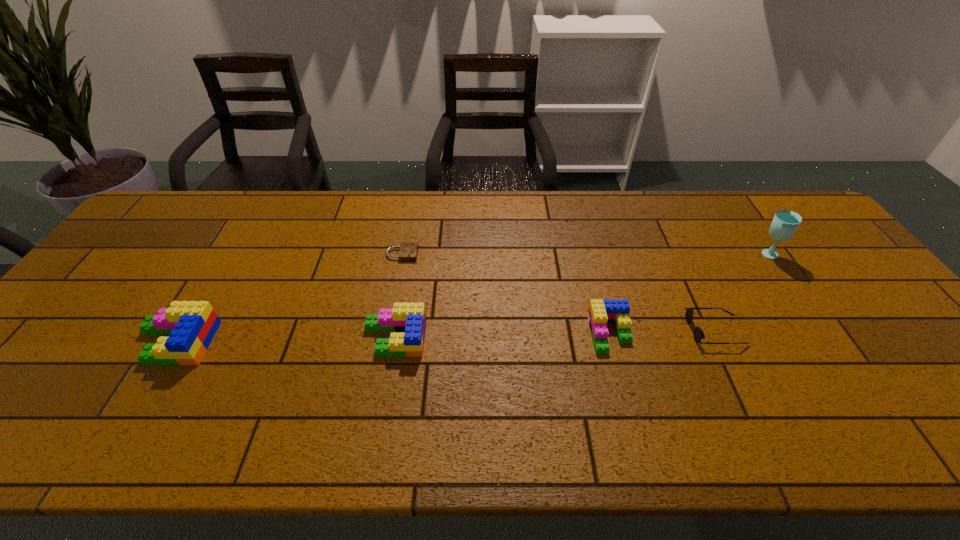
I want to click on free space located on the right of the leftmost Lego, so click(x=268, y=343).

Locate an element on the screen. This screenshot has width=960, height=540. vacant region located 0.320m on the back of the second Lego from left to right is located at coordinates (411, 240).

In order to click on blank area located on the back of the rightmost Lego in this screenshot , I will do `click(592, 267)`.

Image resolution: width=960 pixels, height=540 pixels. In order to click on free space located 0.270m on the left of the glass in this screenshot , I will do `click(666, 253)`.

This screenshot has width=960, height=540. I want to click on free spot located 0.370m on the keyhole side of the padlock, so click(541, 254).

I want to click on vacant space located 0.260m on the front-facing side of the fifth object from left to right, so click(x=587, y=330).

The height and width of the screenshot is (540, 960). I want to click on free space located 0.270m on the front-facing side of the fifth object from left to right, so click(x=583, y=330).

The height and width of the screenshot is (540, 960). I want to click on blank area located 0.150m on the front-facing side of the fifth object from left to right, so point(630,330).

At what (x,y) coordinates should I click in order to perform the action: click on free space at the far edge of the desktop. Please return your answer as a coordinate pair (x, y). Looking at the image, I should click on (232, 201).

The width and height of the screenshot is (960, 540). In order to click on vacant space at the near edge of the desktop in this screenshot , I will do `click(789, 373)`.